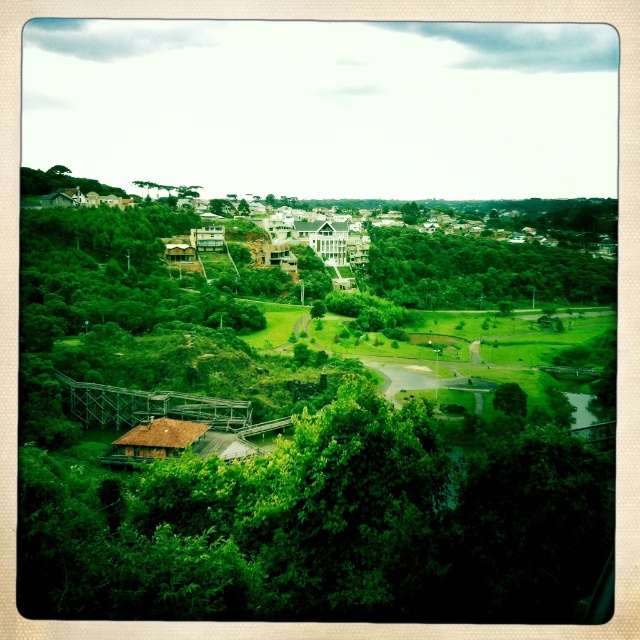
You are standing at the elevated viewpoint overlooking the landscape. You notice the green leafy tree at center and the green grassy field at center. Which of these two is closer to your current position?

The green leafy tree at center is closer to the viewer than the green grassy field at center.

You are standing at the wooden structure with a reddish brown roof and want to walk to the park area. You see two points marked on your map as point 1 at coordinates point (563,316) and point 2 at coordinates point (109,188). Which point is closer to your current location?

Point 1 at coordinates point (563,316) is closer to your current location because it is in front of point 2 at coordinates point (109,188).